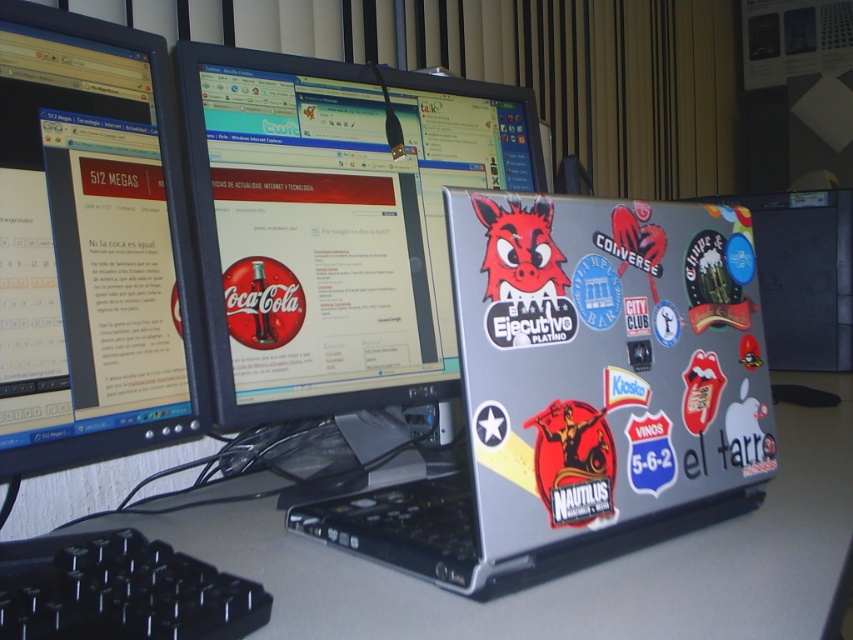
Based on the photo, you are organizing a desk setup and want to place a new keyboard between the black glossy monitor at left and the silver metallic computer desk at center. Based on their positions, can you place the keyboard in between them?

The silver metallic computer desk at center is behind the black glossy monitor at left, so there is no space between them for placing the keyboard.

You are organizing a desk setup and want to place a new sticker on the laptop. The sticker has a width of 0.05 units. The point representing the black glossy monitor at left is at coordinate point(88, 244). Can you determine if the sticker will fit horizontally on the laptop without overlapping the black glossy monitor at left?

The black glossy monitor at left is represented by point(88, 244). Since the sticker is 0.05 units wide and the monitor is at point(88, 244), there is enough space between them to place the sticker on the laptop without overlapping.